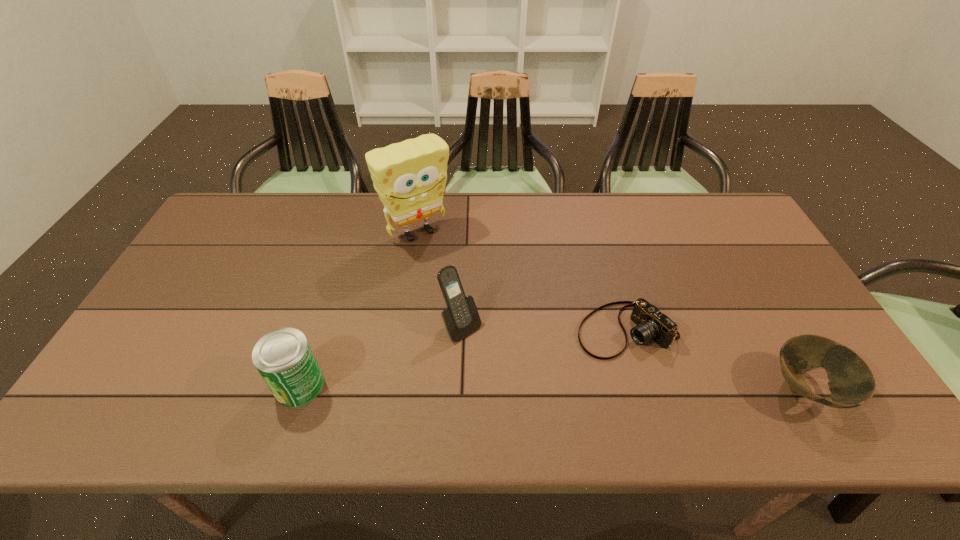
Where is `can that is positioned at the near edge`? can that is positioned at the near edge is located at coordinates (283, 357).

Locate an element on the screen. This screenshot has height=540, width=960. bowl located at the near edge is located at coordinates (851, 382).

Identify the location of object at the right edge. [x=851, y=382].

Identify the location of object at the near right corner. The image size is (960, 540). (851, 382).

Where is `free space at the far edge of the desktop`? This screenshot has width=960, height=540. free space at the far edge of the desktop is located at coordinates (568, 221).

Locate an element on the screen. vacant area at the near edge is located at coordinates [x=691, y=369].

Where is `vacant area at the left edge`? The width and height of the screenshot is (960, 540). vacant area at the left edge is located at coordinates (199, 301).

Locate an element on the screen. The height and width of the screenshot is (540, 960). blank space at the right edge of the desktop is located at coordinates (764, 302).

Locate an element on the screen. Image resolution: width=960 pixels, height=540 pixels. blank space at the far left corner of the desktop is located at coordinates (244, 199).

In the image, there is a desktop. In order to click on vacant area at the near left corner in this screenshot , I will do `click(145, 366)`.